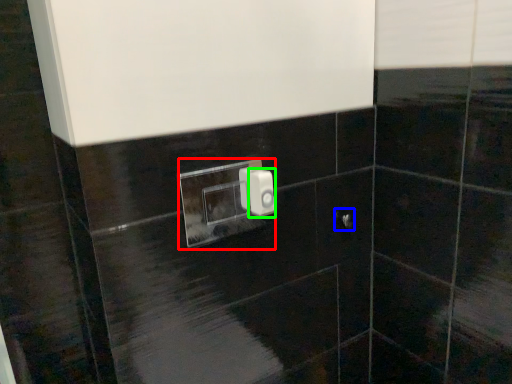
Question: Based on their relative distances, which object is nearer to light switch (highlighted by a red box)? Choose from door handle (highlighted by a blue box) and light switch (highlighted by a green box).

Choices:
 (A) door handle
 (B) light switch

Answer: (A)